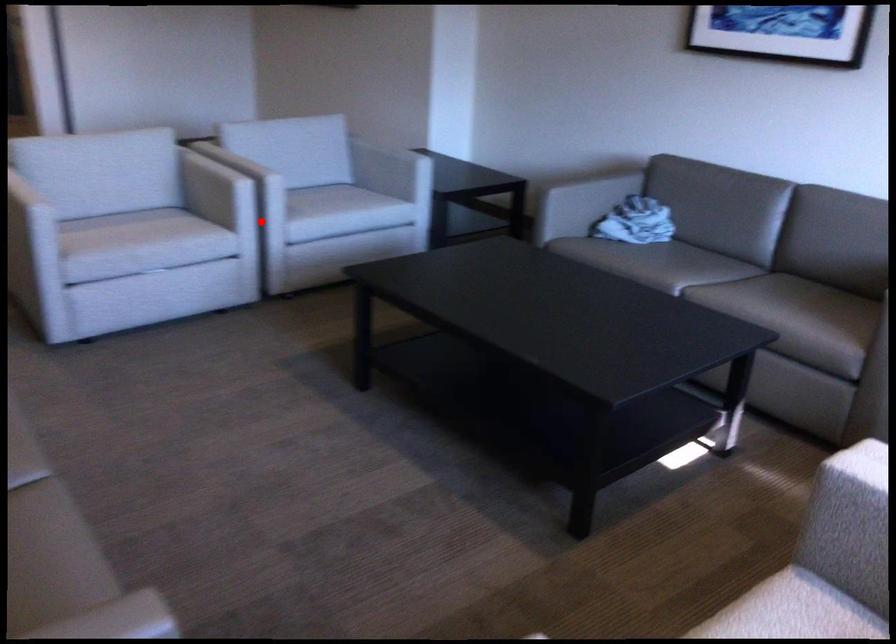
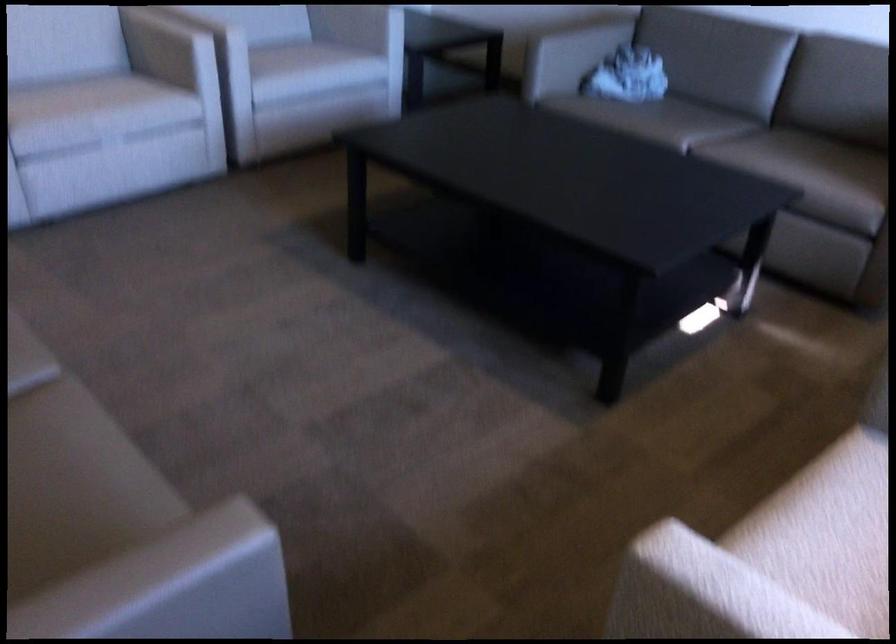
In the second image, find the point that corresponds to the highlighted location in the first image.

(227, 80)